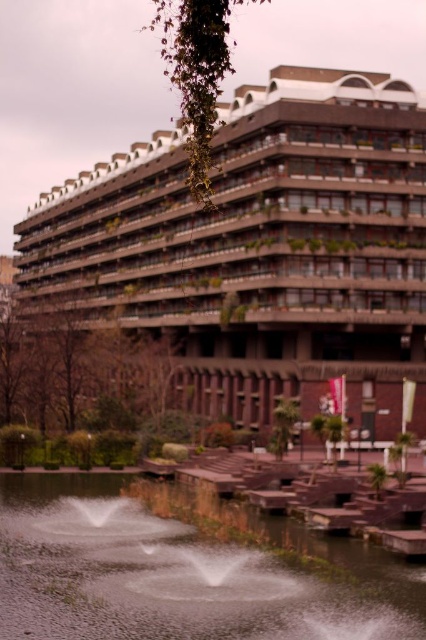
Can you confirm if brown concrete building at center is positioned below clear water at center?

Actually, brown concrete building at center is above clear water at center.

How far apart are brown concrete building at center and clear water at center?

brown concrete building at center and clear water at center are 38.90 meters apart.

Between point (362, 365) and point (16, 570), which one is positioned behind?

The point (362, 365) is behind.

The height and width of the screenshot is (640, 426). Identify the location of brown concrete building at center. (258, 250).